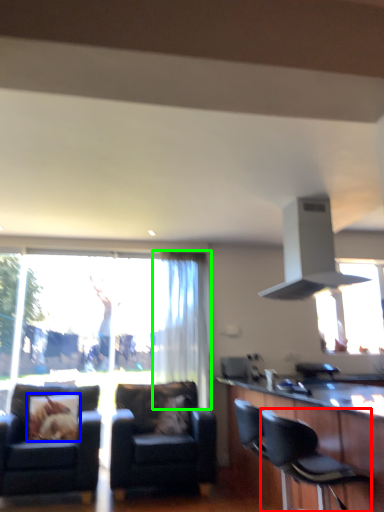
Question: Based on their relative distances, which object is nearer to chair (highlighted by a red box)? Choose from pillow (highlighted by a blue box) and curtain (highlighted by a green box).

Choices:
 (A) pillow
 (B) curtain

Answer: (A)